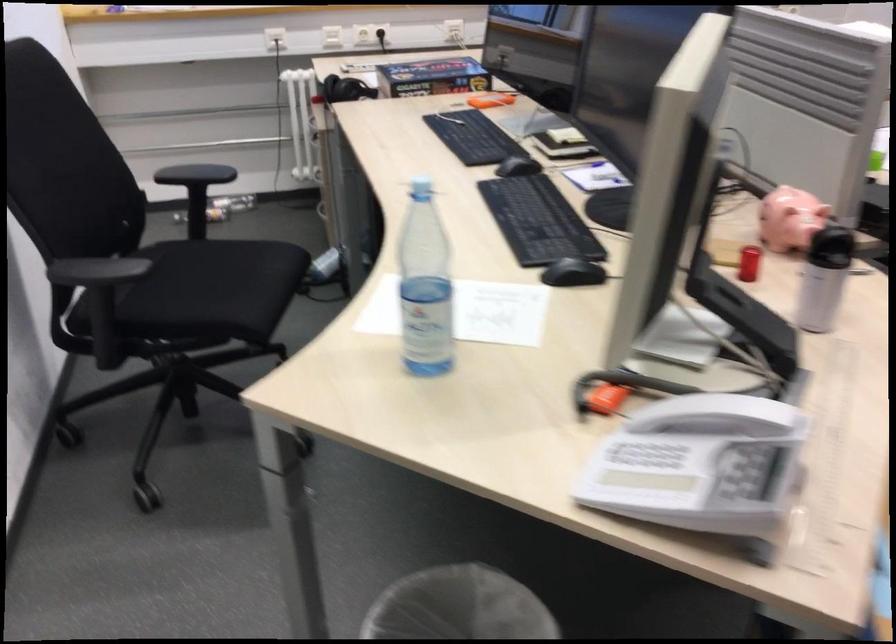
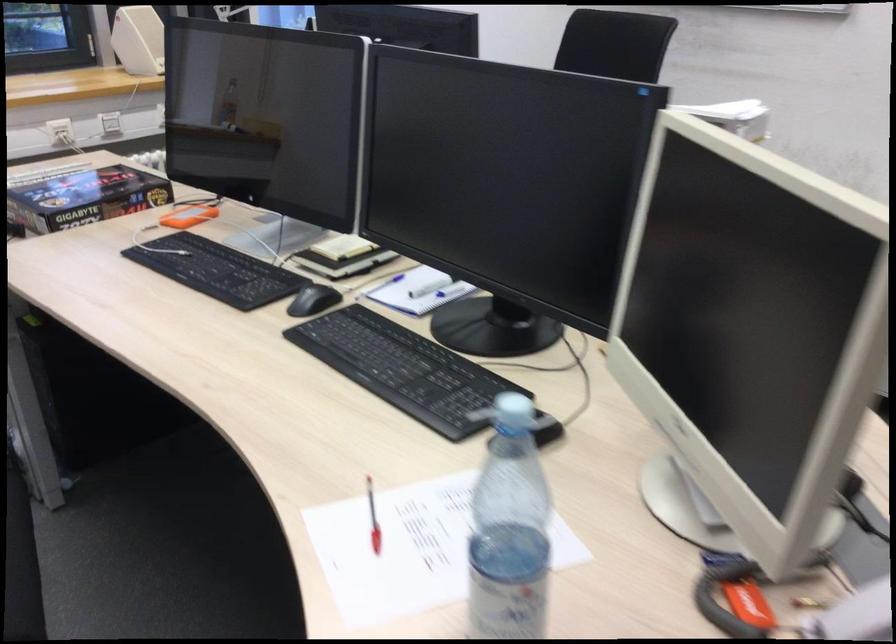
Locate, in the second image, the point that corresponds to [560,138] in the first image.

(341, 256)